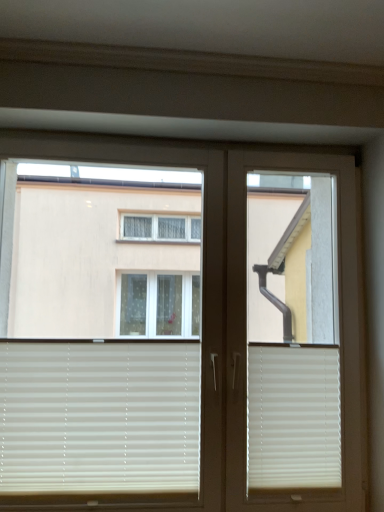
Question: Is beige matte blinds at lower left, which is counted as the 2th window blind, starting from the right, placed right next to white matte window blind at lower right, which ranks as the first window blind in right-to-left order?

Choices:
 (A) no
 (B) yes

Answer: (A)

Question: Is beige matte blinds at lower left, the first window blind in the left-to-right sequence, thinner than white matte window blind at lower right, acting as the second window blind starting from the left?

Choices:
 (A) yes
 (B) no

Answer: (B)

Question: Can white matte window blind at lower right, which ranks as the first window blind in right-to-left order, be found inside beige matte blinds at lower left, which is counted as the 2th window blind, starting from the right?

Choices:
 (A) yes
 (B) no

Answer: (B)

Question: Is beige matte blinds at lower left, the first window blind in the left-to-right sequence, facing away from white matte window blind at lower right, which ranks as the first window blind in right-to-left order?

Choices:
 (A) yes
 (B) no

Answer: (B)

Question: Can you confirm if beige matte blinds at lower left, which is counted as the 2th window blind, starting from the right, is wider than white matte window blind at lower right, acting as the second window blind starting from the left?

Choices:
 (A) yes
 (B) no

Answer: (A)

Question: Is the position of beige matte blinds at lower left, the first window blind in the left-to-right sequence, more distant than that of white matte window blind at lower right, which ranks as the first window blind in right-to-left order?

Choices:
 (A) yes
 (B) no

Answer: (B)

Question: Does white plastic screen door at center have a lesser width compared to white matte window blind at lower right, acting as the second window blind starting from the left?

Choices:
 (A) no
 (B) yes

Answer: (A)

Question: Can you confirm if white plastic screen door at center is taller than white matte window blind at lower right, acting as the second window blind starting from the left?

Choices:
 (A) yes
 (B) no

Answer: (A)

Question: From the image's perspective, would you say white plastic screen door at center is shown under white matte window blind at lower right, which ranks as the first window blind in right-to-left order?

Choices:
 (A) yes
 (B) no

Answer: (B)

Question: Is white plastic screen door at center oriented towards white matte window blind at lower right, acting as the second window blind starting from the left?

Choices:
 (A) no
 (B) yes

Answer: (B)

Question: Is white plastic screen door at center positioned behind white matte window blind at lower right, acting as the second window blind starting from the left?

Choices:
 (A) no
 (B) yes

Answer: (A)

Question: Is the position of white plastic screen door at center less distant than that of white matte window blind at lower right, which ranks as the first window blind in right-to-left order?

Choices:
 (A) no
 (B) yes

Answer: (B)

Question: Is beige matte blinds at lower left, the first window blind in the left-to-right sequence, further to camera compared to white plastic screen door at center?

Choices:
 (A) no
 (B) yes

Answer: (A)